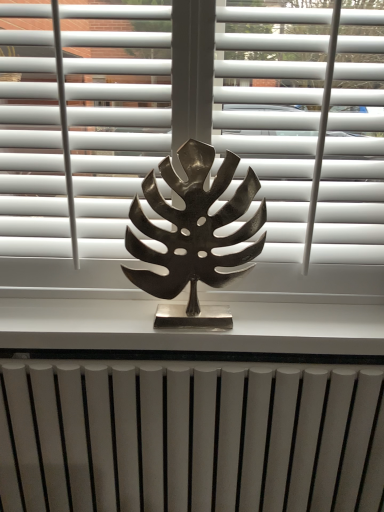
Identify the location of empty space that is ontop of white matte radiator at bottom (from a real-world perspective). (192, 361).